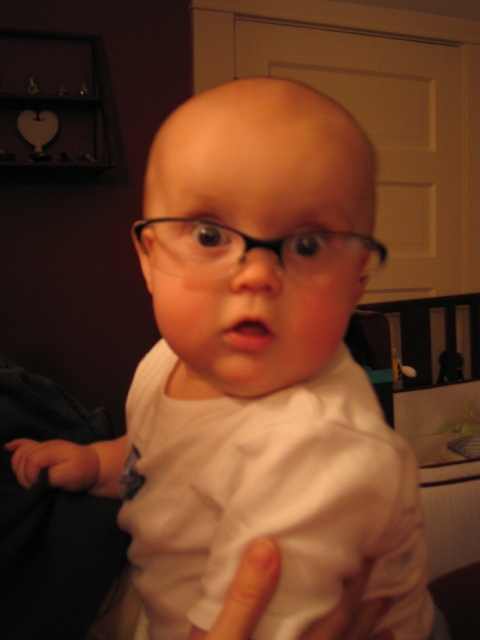
You are a photographer setting up for a baby photoshoot. You need to position a small prop between the white soft hand at lower left and the white matte finger at lower center. The prop is 3 inches long. Will there be enough space between the two objects to place the prop?

The distance between the white soft hand at lower left and the white matte finger at lower center is 10.11 inches. Since the prop is only 3 inches long, there is sufficient space to place it between them.

You are a photographer adjusting the lighting for a baby photo shoot. You notice the white soft hand at lower left and the white matte finger at lower center in the image. Which object should you adjust the lighting on first if you want to ensure both are equally visible?

You should adjust the lighting on the white matte finger at lower center first because it is smaller than the white soft hand at lower left, making it potentially less visible. By brightening the smaller object, you can balance their visibility.

You are a photographer adjusting your camera settings. You notice two points in the image at coordinates point [26,472] and point [255,621]. Which point is closer to the camera lens?

Point [26,472] is further to the camera than point [255,621], so the point closer to the camera lens is point [255,621].